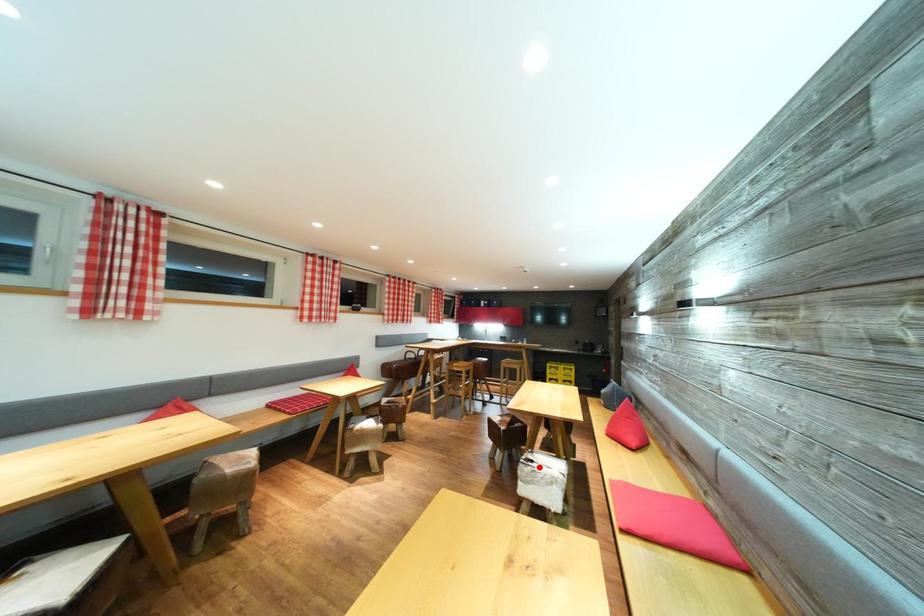
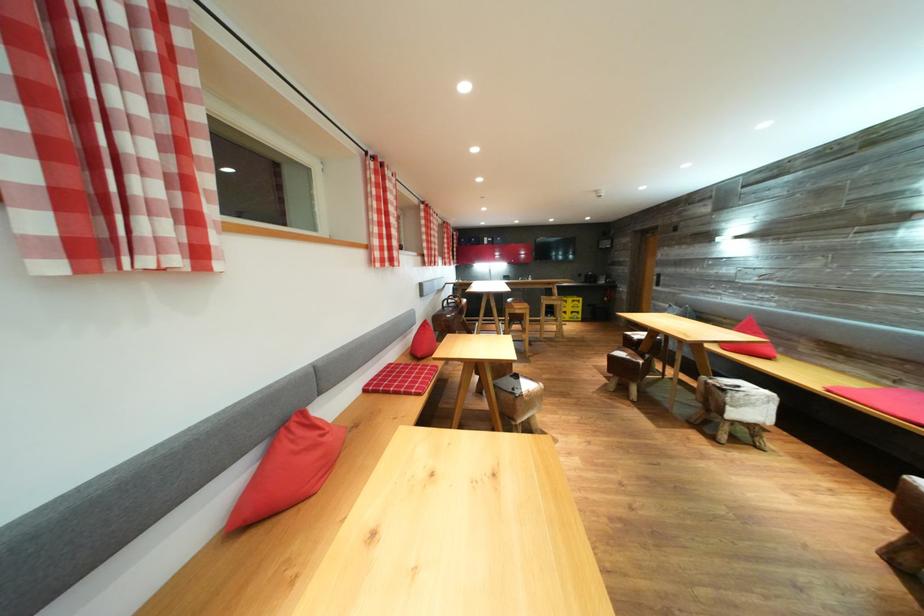
Where in the second image is the point corresponding to the highlighted location from the first image?

(745, 392)